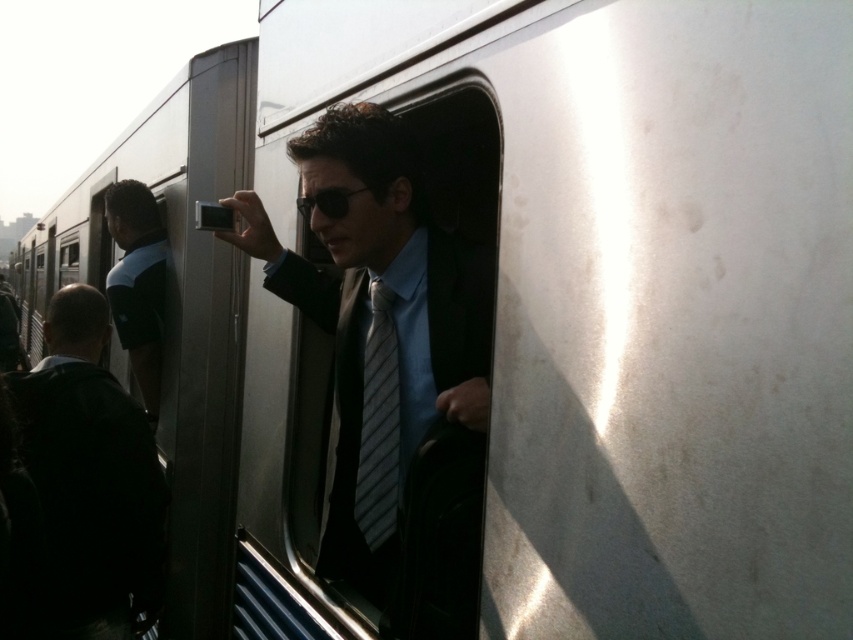
Where is the shiny black suit at center located in the image?

The shiny black suit at center is located at point (389,369).

Looking at the man in the train, which object is positioned more to the left between the dark blue shirt at left and the striped fabric tie at center?

The dark blue shirt at left is positioned more to the left than the striped fabric tie at center.

You are a passenger on the train and want to take a photo of the landscape outside. You notice two points marked on the window. The first point is at coordinate point (410, 548) and the second is at point (380, 376). Which point would give you a clearer view of the landscape outside the train?

Point (410, 548) is in front of point (380, 376), so the first point would provide a clearer view as it is closer to the outside of the window.